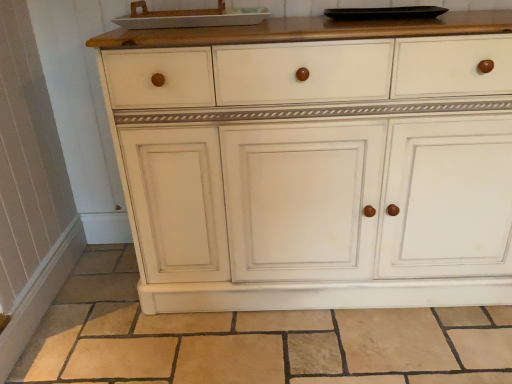
Describe the element at coordinates (189, 17) in the screenshot. The width and height of the screenshot is (512, 384). I see `white glossy tray at upper center` at that location.

Locate an element on the screen. The width and height of the screenshot is (512, 384). white glossy tray at upper center is located at coordinates (189, 17).

This screenshot has width=512, height=384. Identify the location of white glossy tray at upper center. (189, 17).

In the scene shown: Which object is closer to the camera, white painted wood cabinet at center or white glossy tray at upper center?

white painted wood cabinet at center is in front.

From a real-world perspective, is white painted wood cabinet at center under white glossy tray at upper center?

Yes, from a real-world perspective, white painted wood cabinet at center is beneath white glossy tray at upper center.

Who is bigger, white painted wood cabinet at center or white glossy tray at upper center?

Bigger between the two is white painted wood cabinet at center.

Is white glossy tray at upper center at the back of white painted wood cabinet at center?

No, white painted wood cabinet at center is not facing away from white glossy tray at upper center.

Does white glossy tray at upper center touch beige tile at lower center?

No, white glossy tray at upper center is not next to beige tile at lower center.

From the image's perspective, is white glossy tray at upper center below beige tile at lower center?

No, from the image's perspective, white glossy tray at upper center is not below beige tile at lower center.

Where is `tile that appears below the white glossy tray at upper center (from a real-world perspective)`? The image size is (512, 384). tile that appears below the white glossy tray at upper center (from a real-world perspective) is located at coordinates (253, 339).

From a real-world perspective, does white glossy tray at upper center sit lower than beige tile at lower center?

No, from a real-world perspective, white glossy tray at upper center is not beneath beige tile at lower center.

Looking at this image, based on their sizes in the image, would you say white glossy tray at upper center is bigger or smaller than white painted wood cabinet at center?

Clearly, white glossy tray at upper center is smaller in size than white painted wood cabinet at center.

Based on the photo, could you tell me if white glossy tray at upper center is facing white painted wood cabinet at center?

No, white glossy tray at upper center is not oriented towards white painted wood cabinet at center.

Find the location of a particular element. This screenshot has width=512, height=384. sink lying behind the white painted wood cabinet at center is located at coordinates (189, 17).

Can you confirm if white glossy tray at upper center is thinner than white painted wood cabinet at center?

Indeed, white glossy tray at upper center has a lesser width compared to white painted wood cabinet at center.

Could white painted wood cabinet at center be considered to be inside beige tile at lower center?

No, white painted wood cabinet at center is not surrounded by beige tile at lower center.

Where is `tile below the white painted wood cabinet at center (from the image's perspective)`? The height and width of the screenshot is (384, 512). tile below the white painted wood cabinet at center (from the image's perspective) is located at coordinates (253, 339).

Considering the relative positions of beige tile at lower center and white painted wood cabinet at center in the image provided, is beige tile at lower center to the right of white painted wood cabinet at center from the viewer's perspective?

No, beige tile at lower center is not to the right of white painted wood cabinet at center.

From a real-world perspective, between beige tile at lower center and white painted wood cabinet at center, who is vertically higher?

white painted wood cabinet at center is physically above.

Does beige tile at lower center appear on the right side of white glossy tray at upper center?

Correct, you'll find beige tile at lower center to the right of white glossy tray at upper center.

Does point (426, 374) come in front of point (219, 25)?

Yes, it is in front of point (219, 25).

From a real-world perspective, is beige tile at lower center located higher than white glossy tray at upper center?

Incorrect, from a real-world perspective, beige tile at lower center is lower than white glossy tray at upper center.

Is white painted wood cabinet at center positioned far away from beige tile at lower center?

No, white painted wood cabinet at center is in close proximity to beige tile at lower center.

Considering the relative positions of white painted wood cabinet at center and beige tile at lower center in the image provided, is white painted wood cabinet at center to the left of beige tile at lower center from the viewer's perspective?

Incorrect, white painted wood cabinet at center is not on the left side of beige tile at lower center.

Based on the photo, from the image's perspective, would you say white painted wood cabinet at center is shown under beige tile at lower center?

Incorrect, from the image's perspective, white painted wood cabinet at center is higher than beige tile at lower center.

At what (x,y) coordinates should I click in order to perform the action: click on the chest of drawers lying in front of the white glossy tray at upper center. Please return your answer as a coordinate pair (x, y). The image size is (512, 384). Looking at the image, I should click on (314, 165).

Where is `tile located underneath the white glossy tray at upper center (from a real-world perspective)`? This screenshot has height=384, width=512. tile located underneath the white glossy tray at upper center (from a real-world perspective) is located at coordinates (253, 339).

From the picture: Considering their positions, is beige tile at lower center positioned closer to white glossy tray at upper center than white painted wood cabinet at center?

white painted wood cabinet at center.

Which object lies nearer to the anchor point white glossy tray at upper center, white painted wood cabinet at center or beige tile at lower center?

white painted wood cabinet at center.

Based on their spatial positions, is white glossy tray at upper center or beige tile at lower center further from white painted wood cabinet at center?

The object further to white painted wood cabinet at center is white glossy tray at upper center.

Considering their positions, is white painted wood cabinet at center positioned further to beige tile at lower center than white glossy tray at upper center?

Among the two, white glossy tray at upper center is located further to beige tile at lower center.

Which object lies nearer to the anchor point beige tile at lower center, white glossy tray at upper center or white painted wood cabinet at center?

white painted wood cabinet at center.

Based on their spatial positions, is beige tile at lower center or white glossy tray at upper center further from white painted wood cabinet at center?

white glossy tray at upper center lies further to white painted wood cabinet at center than the other object.

In order to click on chest of drawers between white glossy tray at upper center and beige tile at lower center from top to bottom in this screenshot , I will do `click(314, 165)`.